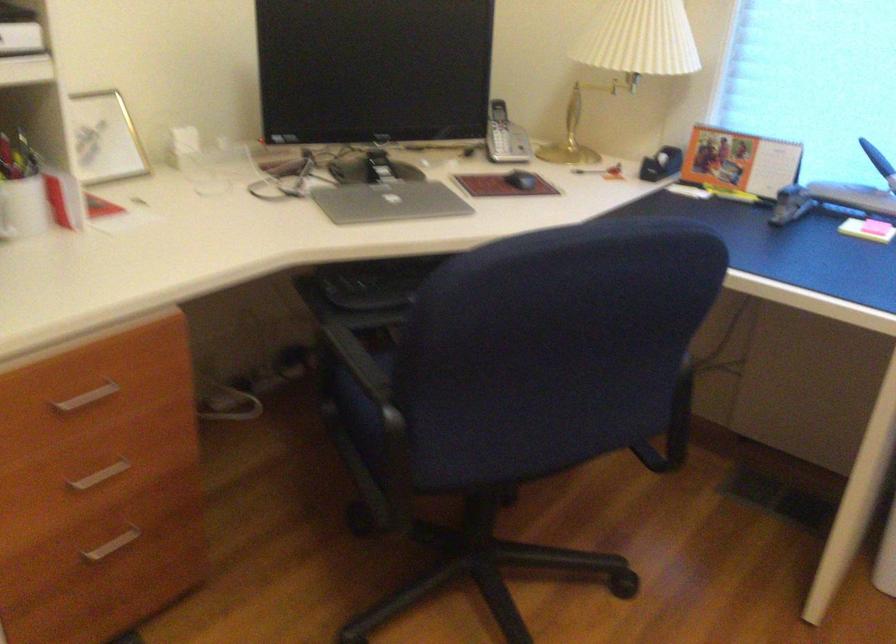
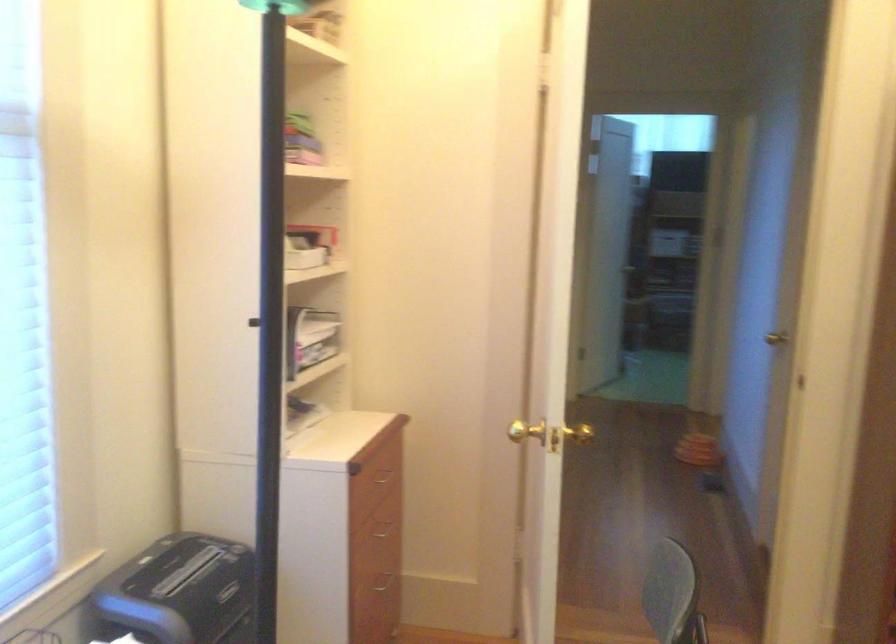
First-person continuous shooting, in which direction is the camera rotating?

The camera rotated toward right-down.